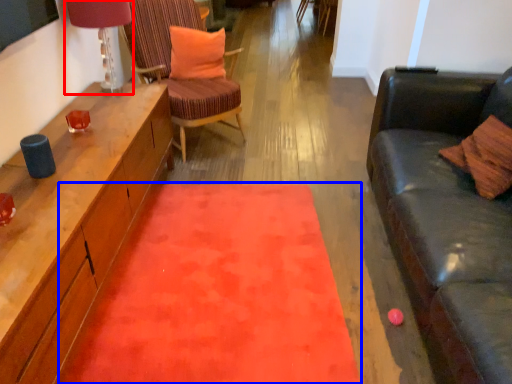
Question: Which of the following is the farthest to the observer, lamp (highlighted by a red box) or mat (highlighted by a blue box)?

Choices:
 (A) lamp
 (B) mat

Answer: (A)